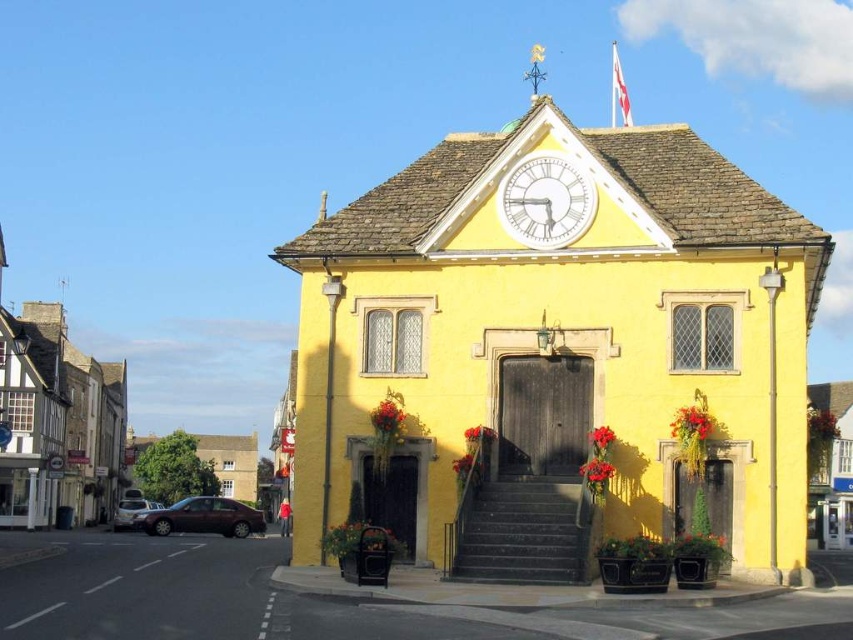
Question: Does yellow stone church at center have a larger size compared to white glass clock at upper center?

Choices:
 (A) yes
 (B) no

Answer: (A)

Question: Is yellow stone church at center further to camera compared to dark gray stone stairs at center?

Choices:
 (A) yes
 (B) no

Answer: (B)

Question: Which point appears farthest from the camera in this image?

Choices:
 (A) (555, 236)
 (B) (567, 500)

Answer: (A)

Question: Which of these objects is positioned closest to the white glass clock at upper center?

Choices:
 (A) yellow stone church at center
 (B) dark gray stone stairs at center

Answer: (A)

Question: Does yellow stone church at center lie in front of dark gray stone stairs at center?

Choices:
 (A) yes
 (B) no

Answer: (A)

Question: Which object appears closest to the camera in this image?

Choices:
 (A) dark gray stone stairs at center
 (B) white glass clock at upper center
 (C) yellow stone church at center

Answer: (C)